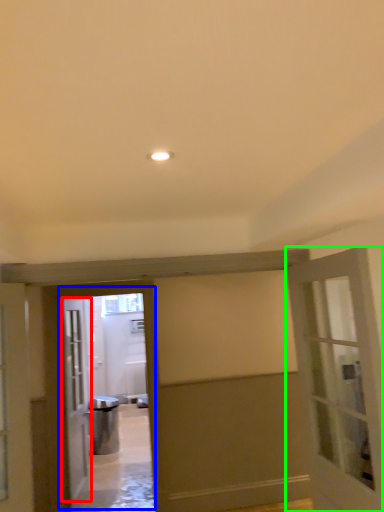
Question: Which is farther away from door (highlighted by a red box)? elevator (highlighted by a blue box) or door (highlighted by a green box)?

Choices:
 (A) elevator
 (B) door

Answer: (B)